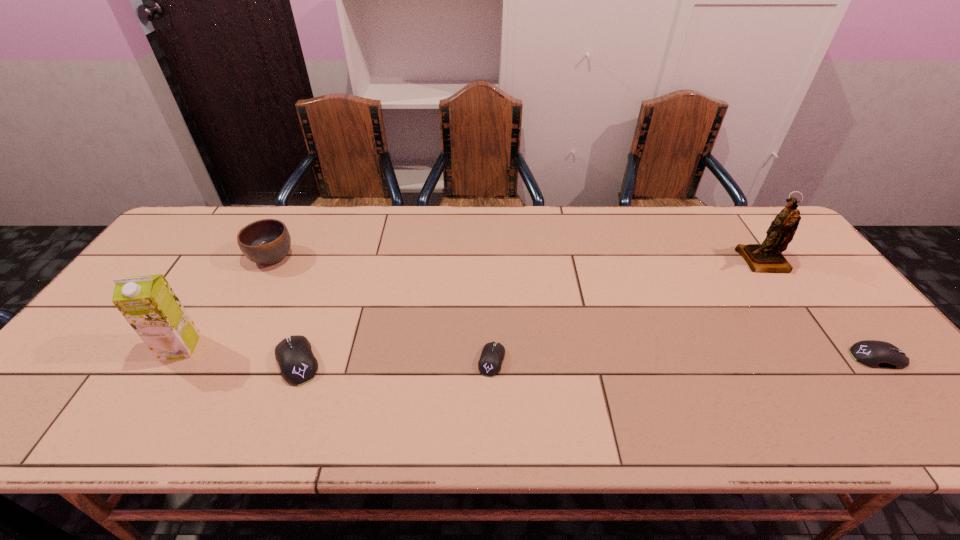
Find the location of a particular element. free spot that satisfies the following two spatial constraints: 1. on the front-facing side of the figurine; 2. on the left side of the fifth tallest object is located at coordinates (831, 357).

You are a GUI agent. You are given a task and a screenshot of the screen. Output one action in this format:
    pyautogui.click(x=<x>, y=<y>)
    Task: Click on the free point that satisfies the following two spatial constraints: 1. on the front-facing side of the figurine; 2. on the left side of the second shortest object
    
    Given the screenshot: What is the action you would take?
    pyautogui.click(x=831, y=357)

The width and height of the screenshot is (960, 540). Identify the location of vacant space that satisfies the following two spatial constraints: 1. on the front side of the second shortest object; 2. on the right side of the soya milk. (174, 357).

Where is `free space in the image that satisfies the following two spatial constraints: 1. on the front side of the third object from left to right; 2. on the right side of the soya milk`? The height and width of the screenshot is (540, 960). free space in the image that satisfies the following two spatial constraints: 1. on the front side of the third object from left to right; 2. on the right side of the soya milk is located at coordinates (172, 361).

Identify the location of free location that satisfies the following two spatial constraints: 1. on the front side of the shortest computer equipment; 2. on the right side of the bowl. This screenshot has height=540, width=960. (217, 360).